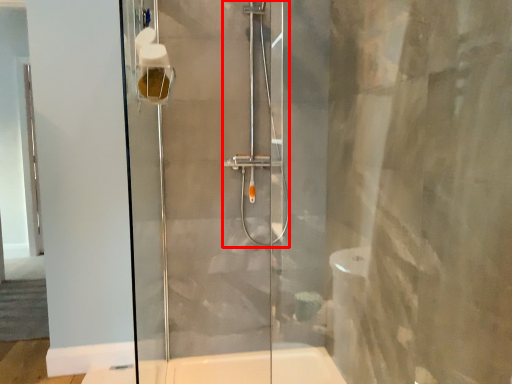
Question: From the image's perspective, where is shower (annotated by the red box) located in relation to toilet paper in the image?

Choices:
 (A) above
 (B) below

Answer: (B)